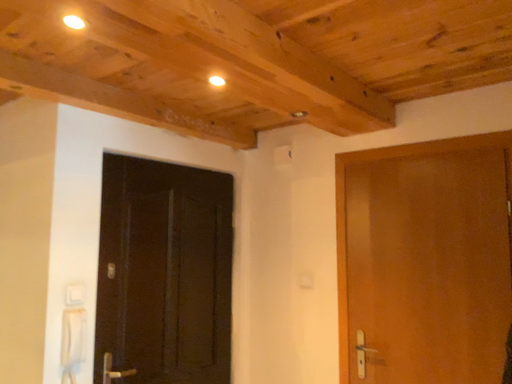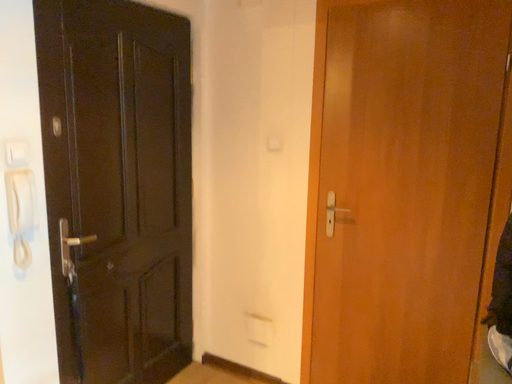
Question: How did the camera likely rotate when shooting the video?

Choices:
 (A) rotated downward
 (B) rotated upward

Answer: (A)